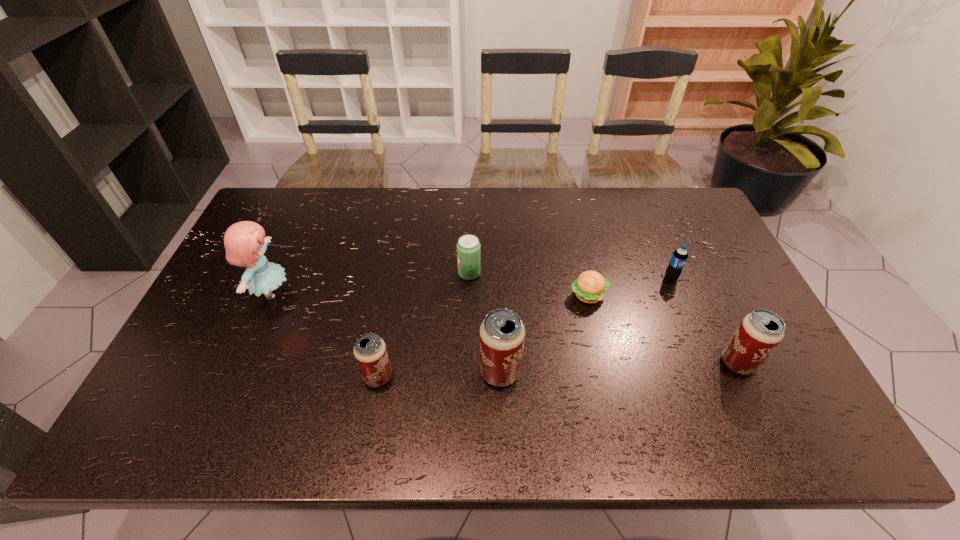
At what (x,y) coordinates should I click in order to perform the action: click on the shortest beer can. Please return your answer as a coordinate pair (x, y). Looking at the image, I should click on (370, 351).

Locate an element on the screen. The height and width of the screenshot is (540, 960). the second object from left to right is located at coordinates pos(370,351).

Image resolution: width=960 pixels, height=540 pixels. In order to click on the second beer can from left to right in this screenshot , I will do `click(502, 334)`.

I want to click on the rightmost beer can, so click(759, 333).

Locate an element on the screen. Image resolution: width=960 pixels, height=540 pixels. the third tallest object is located at coordinates (759, 333).

Where is `the tallest object`? the tallest object is located at coordinates (245, 243).

Identify the location of doll. The image size is (960, 540). (245, 243).

The height and width of the screenshot is (540, 960). I want to click on the right soda, so click(x=679, y=257).

Identify the location of the left soda. This screenshot has width=960, height=540. (468, 247).

At what (x,y) coordinates should I click in order to perform the action: click on hamburger. Please return your answer as a coordinate pair (x, y). The width and height of the screenshot is (960, 540). Looking at the image, I should click on (589, 287).